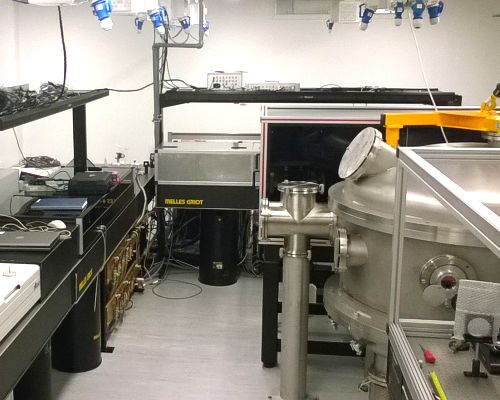
This screenshot has width=500, height=400. What are the coordinates of `laptop` in the screenshot? It's located at (38, 243).